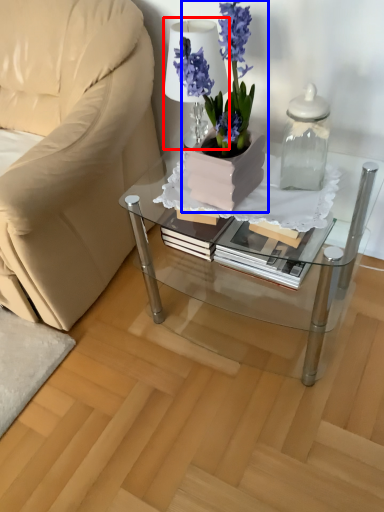
Question: Among these objects, which one is nearest to the camera, table lamp (highlighted by a red box) or houseplant (highlighted by a blue box)?

Choices:
 (A) table lamp
 (B) houseplant

Answer: (B)